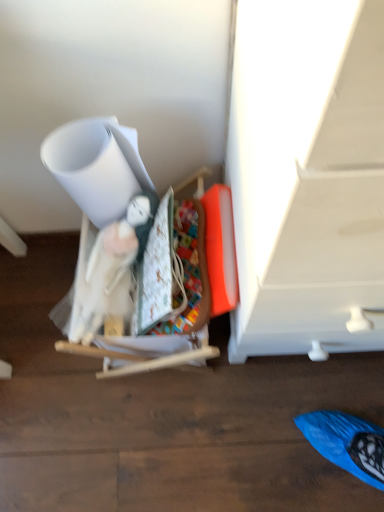
This screenshot has width=384, height=512. Describe the element at coordinates (166, 349) in the screenshot. I see `white fabric doll at left` at that location.

Find the location of a particular element. The width and height of the screenshot is (384, 512). white fabric doll at left is located at coordinates (166, 349).

Where is `white fabric doll at left`? This screenshot has height=512, width=384. white fabric doll at left is located at coordinates (166, 349).